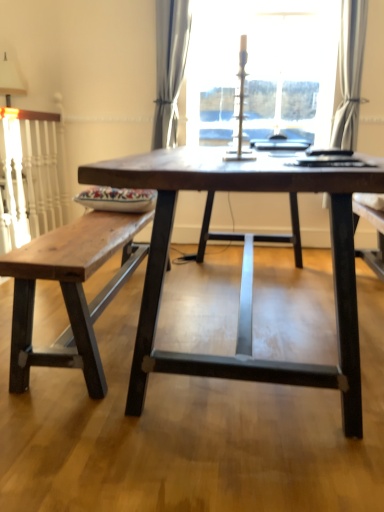
Question: Should I look upward or downward to see satin gray curtain at center, acting as the 1th curtain starting from the left?

Choices:
 (A) up
 (B) down

Answer: (A)

Question: From a real-world perspective, is dark wood table at center located higher than satin gray curtain at center, the 2th curtain when ordered from right to left?

Choices:
 (A) yes
 (B) no

Answer: (B)

Question: Considering the relative sizes of dark wood table at center and satin gray curtain at center, the 2th curtain when ordered from right to left, in the image provided, is dark wood table at center taller than satin gray curtain at center, the 2th curtain when ordered from right to left,?

Choices:
 (A) yes
 (B) no

Answer: (B)

Question: Can satin gray curtain at center, acting as the 1th curtain starting from the left, be found inside dark wood table at center?

Choices:
 (A) yes
 (B) no

Answer: (B)

Question: Is dark wood table at center aimed at satin gray curtain at center, the 2th curtain when ordered from right to left?

Choices:
 (A) no
 (B) yes

Answer: (A)

Question: Is dark wood table at center looking in the opposite direction of satin gray curtain at center, the 2th curtain when ordered from right to left?

Choices:
 (A) yes
 (B) no

Answer: (B)

Question: Can you confirm if dark wood table at center is bigger than satin gray curtain at center, acting as the 1th curtain starting from the left?

Choices:
 (A) yes
 (B) no

Answer: (A)

Question: Does satin gray curtain at center, the 2th curtain when ordered from right to left, have a greater width compared to white fabric lampshade at upper left?

Choices:
 (A) no
 (B) yes

Answer: (A)

Question: Is satin gray curtain at center, the 2th curtain when ordered from right to left, positioned before white fabric lampshade at upper left?

Choices:
 (A) yes
 (B) no

Answer: (A)

Question: Can you confirm if satin gray curtain at center, acting as the 1th curtain starting from the left, is positioned to the right of white fabric lampshade at upper left?

Choices:
 (A) yes
 (B) no

Answer: (A)

Question: Is satin gray curtain at center, the 2th curtain when ordered from right to left, touching white fabric lampshade at upper left?

Choices:
 (A) no
 (B) yes

Answer: (A)

Question: Is satin gray curtain at center, acting as the 1th curtain starting from the left, far away from white fabric lampshade at upper left?

Choices:
 (A) yes
 (B) no

Answer: (A)

Question: Is satin gray curtain at center, acting as the 1th curtain starting from the left, aimed at white fabric lampshade at upper left?

Choices:
 (A) no
 (B) yes

Answer: (A)

Question: Is white fabric lampshade at upper left located outside dark wood table at center?

Choices:
 (A) no
 (B) yes

Answer: (B)